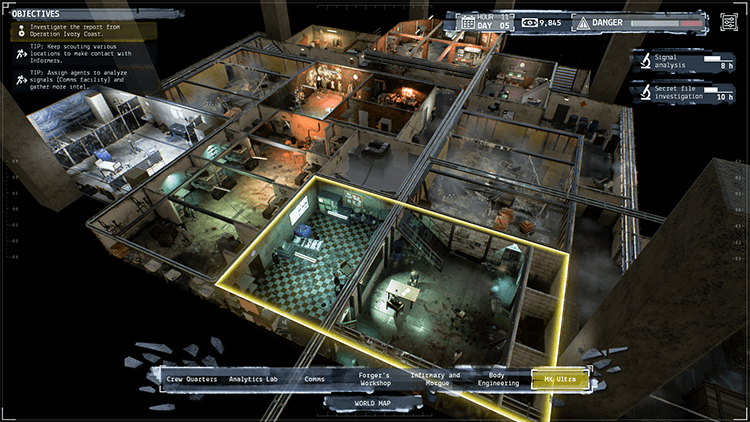
Where is `doorway`? The width and height of the screenshot is (750, 422). doorway is located at coordinates (508, 254), (175, 178).